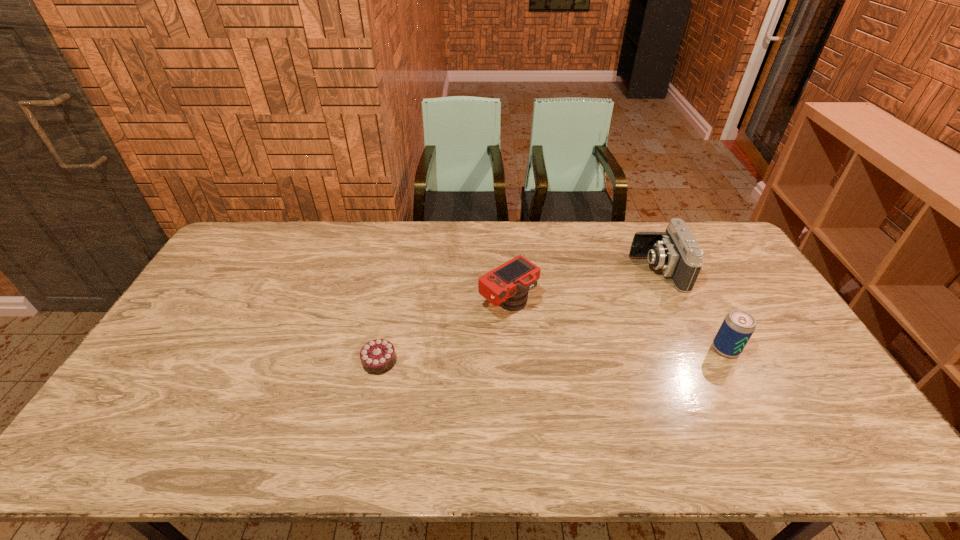
You are a GUI agent. You are given a task and a screenshot of the screen. Output one action in this format:
    pyautogui.click(x=<x>, y=<y>)
    Task: Click on the right camera
    
    Given the screenshot: What is the action you would take?
    pyautogui.click(x=676, y=252)

Locate an element on the screen. The height and width of the screenshot is (540, 960). the third object from right to left is located at coordinates (507, 285).

The image size is (960, 540). I want to click on beer can, so click(x=738, y=326).

Find the location of a particular element. The height and width of the screenshot is (540, 960). the shortest object is located at coordinates tap(378, 356).

The height and width of the screenshot is (540, 960). I want to click on the leftmost object, so click(x=378, y=356).

Find the location of a particular element. This screenshot has width=960, height=540. vacant area located at the front of the right camera with an open lens cover is located at coordinates (615, 271).

The image size is (960, 540). I want to click on free space located 0.260m at the front of the right camera with an open lens cover, so click(557, 271).

Locate an element on the screen. The width and height of the screenshot is (960, 540). vacant space located at the front of the right camera with an open lens cover is located at coordinates (x=580, y=271).

What are the coordinates of `vacant region located 0.300m on the back of the third object from right to left` in the screenshot? It's located at (503, 231).

The width and height of the screenshot is (960, 540). In order to click on vacant space located on the left of the beer can in this screenshot , I will do `click(691, 349)`.